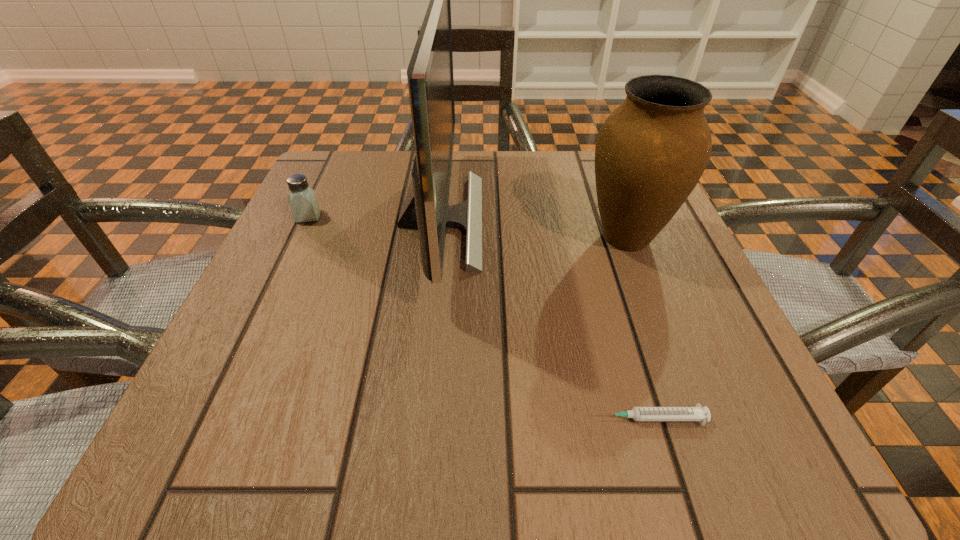
The image size is (960, 540). I want to click on vacant space in between the urn and the tallest object, so click(533, 229).

Locate an element on the screen. Image resolution: width=960 pixels, height=540 pixels. unoccupied position between the syringe and the third tallest object is located at coordinates (479, 318).

Locate an element on the screen. free space between the leftmost object and the tallest object is located at coordinates (374, 218).

Locate an element on the screen. This screenshot has width=960, height=540. vacant region between the shortest object and the third shortest object is located at coordinates (637, 328).

This screenshot has height=540, width=960. I want to click on vacant point located between the third shortest object and the tallest object, so click(x=533, y=229).

Locate an element on the screen. free spot between the nearest object and the tallest object is located at coordinates click(545, 319).

Identify the location of vacant region between the leftmost object and the shortest object. (479, 318).

Find the location of a particular element. The width and height of the screenshot is (960, 540). vacant space that is in between the tallest object and the shortest object is located at coordinates (545, 319).

Identify which object is the second nearest to the second object from left to right. Please provide its 2D coordinates. Your answer should be formatted as a tuple, i.e. [(x, y)], where the tuple contains the x and y coordinates of a point satisfying the conditions above.

[(650, 153)]

In order to click on object identified as the second closest to the shortest object in this screenshot , I will do `click(650, 153)`.